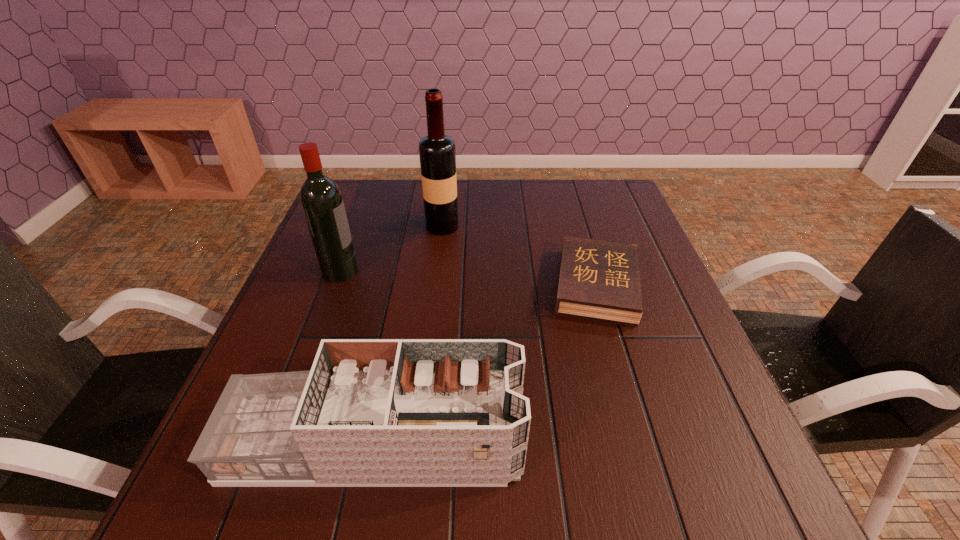
Locate an element on the screen. The image size is (960, 540). vacant point at the right edge is located at coordinates (629, 338).

In the image, there is a desktop. In order to click on vacant space at the far left corner in this screenshot , I will do `click(348, 202)`.

This screenshot has width=960, height=540. In order to click on empty space that is in between the hardback book and the nearer wine bottle in this screenshot , I will do `click(468, 278)`.

Where is `free space between the third tallest object and the farther wine bottle`? free space between the third tallest object and the farther wine bottle is located at coordinates (409, 335).

This screenshot has width=960, height=540. I want to click on free space between the right wine bottle and the nearer wine bottle, so click(x=392, y=248).

Locate an element on the screen. vacant area that lies between the farther wine bottle and the rightmost object is located at coordinates pos(519,256).

Locate an element on the screen. unoccupied area between the left wine bottle and the hardback book is located at coordinates 468,278.

Locate an element on the screen. The image size is (960, 540). vacant space that is in between the left wine bottle and the shortest object is located at coordinates (468, 278).

This screenshot has width=960, height=540. In order to click on free space between the nearer wine bottle and the hardback book in this screenshot , I will do `click(468, 278)`.

Select which object is the closest to the nearer wine bottle. Please provide its 2D coordinates. Your answer should be formatted as a tuple, i.e. [(x, y)], where the tuple contains the x and y coordinates of a point satisfying the conditions above.

[(437, 152)]